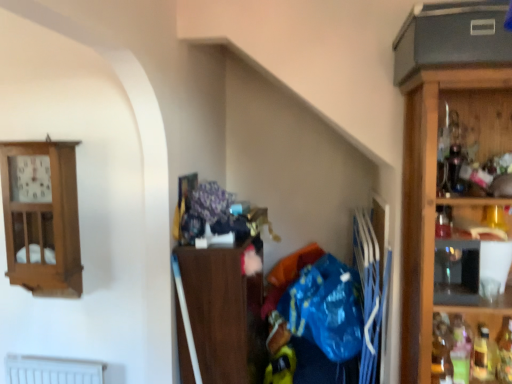
Question: Is translucent plastic bottle at lower right, which is the 4th bottle from left to right, inside translucent glass bottle at lower right, marked as the third bottle in a right-to-left arrangement?

Choices:
 (A) no
 (B) yes

Answer: (A)

Question: Are translucent glass bottle at lower right, placed as the second bottle when sorted from left to right, and translucent plastic bottle at lower right, which is the 4th bottle from left to right, beside each other?

Choices:
 (A) no
 (B) yes

Answer: (A)

Question: Considering the relative sizes of translucent glass bottle at lower right, placed as the second bottle when sorted from left to right, and translucent plastic bottle at lower right, the 1th bottle positioned from the right, in the image provided, is translucent glass bottle at lower right, placed as the second bottle when sorted from left to right, taller than translucent plastic bottle at lower right, the 1th bottle positioned from the right,?

Choices:
 (A) yes
 (B) no

Answer: (B)

Question: Considering the relative sizes of translucent glass bottle at lower right, placed as the second bottle when sorted from left to right, and translucent plastic bottle at lower right, the 1th bottle positioned from the right, in the image provided, is translucent glass bottle at lower right, placed as the second bottle when sorted from left to right, thinner than translucent plastic bottle at lower right, the 1th bottle positioned from the right,?

Choices:
 (A) yes
 (B) no

Answer: (B)

Question: Does translucent glass bottle at lower right, placed as the second bottle when sorted from left to right, have a larger size compared to translucent plastic bottle at lower right, which is the 4th bottle from left to right?

Choices:
 (A) no
 (B) yes

Answer: (A)

Question: From a real-world perspective, is translucent glass bottle at lower right, arranged as the third bottle when viewed from the left, physically located above or below blue plastic bag at center?

Choices:
 (A) below
 (B) above

Answer: (A)

Question: Would you say translucent glass bottle at lower right, which appears as the 2th bottle when viewed from the right, is to the left or to the right of blue plastic bag at center in the picture?

Choices:
 (A) left
 (B) right

Answer: (B)

Question: In the image, is translucent glass bottle at lower right, arranged as the third bottle when viewed from the left, positioned in front of or behind blue plastic bag at center?

Choices:
 (A) behind
 (B) front

Answer: (B)

Question: Based on their sizes in the image, would you say translucent glass bottle at lower right, arranged as the third bottle when viewed from the left, is bigger or smaller than blue plastic bag at center?

Choices:
 (A) small
 (B) big

Answer: (A)

Question: Relative to translucent glass bottle at right, the first bottle viewed from the left, is wooden clock at upper left, acting as the 2th cabinetry starting from the right, in front or behind?

Choices:
 (A) front
 (B) behind

Answer: (B)

Question: Considering the positions of wooden clock at upper left, acting as the 2th cabinetry starting from the right, and translucent glass bottle at right, the first bottle viewed from the left, in the image, is wooden clock at upper left, acting as the 2th cabinetry starting from the right, taller or shorter than translucent glass bottle at right, the first bottle viewed from the left,?

Choices:
 (A) tall
 (B) short

Answer: (A)

Question: From a real-world perspective, is wooden clock at upper left, the 1th cabinetry from the left, positioned above or below translucent glass bottle at right, the first bottle viewed from the left?

Choices:
 (A) below
 (B) above

Answer: (B)

Question: Is wooden clock at upper left, acting as the 2th cabinetry starting from the right, wider or thinner than translucent glass bottle at right, the fourth bottle when ordered from right to left?

Choices:
 (A) thin
 (B) wide

Answer: (B)

Question: Do you think translucent glass bottle at right, the first bottle viewed from the left, is within wooden clock at upper left, acting as the 2th cabinetry starting from the right, or outside of it?

Choices:
 (A) outside
 (B) inside

Answer: (A)

Question: Considering the positions of translucent glass bottle at right, the first bottle viewed from the left, and wooden clock at upper left, acting as the 2th cabinetry starting from the right, in the image, is translucent glass bottle at right, the first bottle viewed from the left, bigger or smaller than wooden clock at upper left, acting as the 2th cabinetry starting from the right,?

Choices:
 (A) big
 (B) small

Answer: (B)